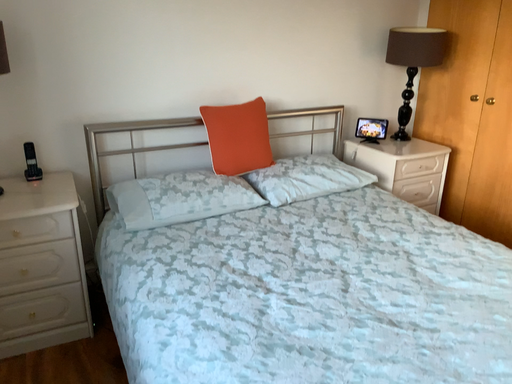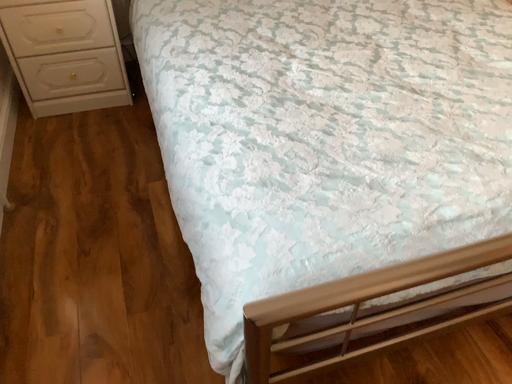
Question: Which way did the camera rotate in the video?

Choices:
 (A) rotated downward
 (B) rotated upward

Answer: (A)